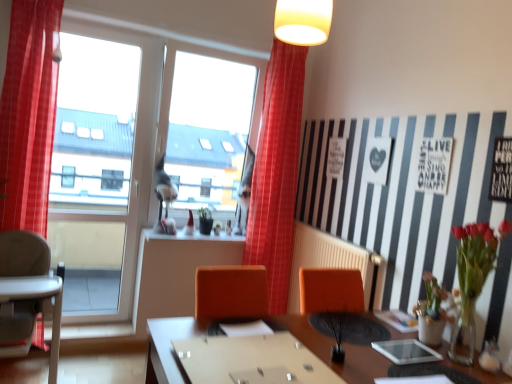
Question: Is gray plastic highchair at left spatially inside wooden table at center, or outside of it?

Choices:
 (A) inside
 (B) outside

Answer: (B)

Question: Based on their sizes in the image, would you say gray plastic highchair at left is bigger or smaller than wooden table at center?

Choices:
 (A) big
 (B) small

Answer: (B)

Question: Estimate the real-world distances between objects in this image. Which object is closer to the white plastic radiator at center?

Choices:
 (A) red plaid curtain at left, the 2th curtain viewed from the back
 (B) wooden table at center
 (C) green matte plant at center, the 2th plant viewed from the right
 (D) vivid red bouquet at right
 (E) transparent glass window at left

Answer: (D)

Question: Which object is the farthest from the transparent glass window at left?

Choices:
 (A) green matte plant at center, the first plant viewed from the left
 (B) green matte plant at center, acting as the 2th plant starting from the top
 (C) wooden table at center
 (D) red checkered curtain at center, placed as the first curtain when sorted from back to front
 (E) vivid red bouquet at right

Answer: (E)